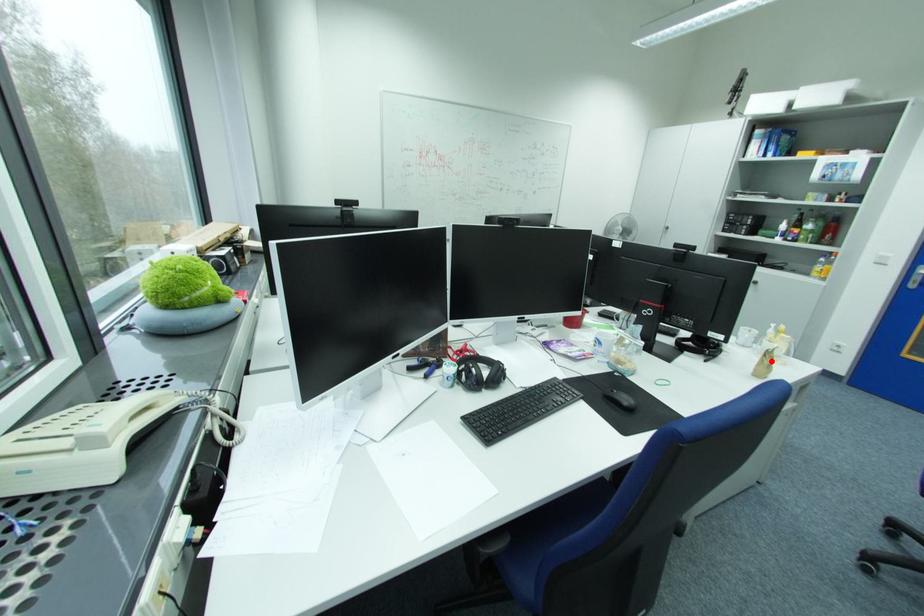
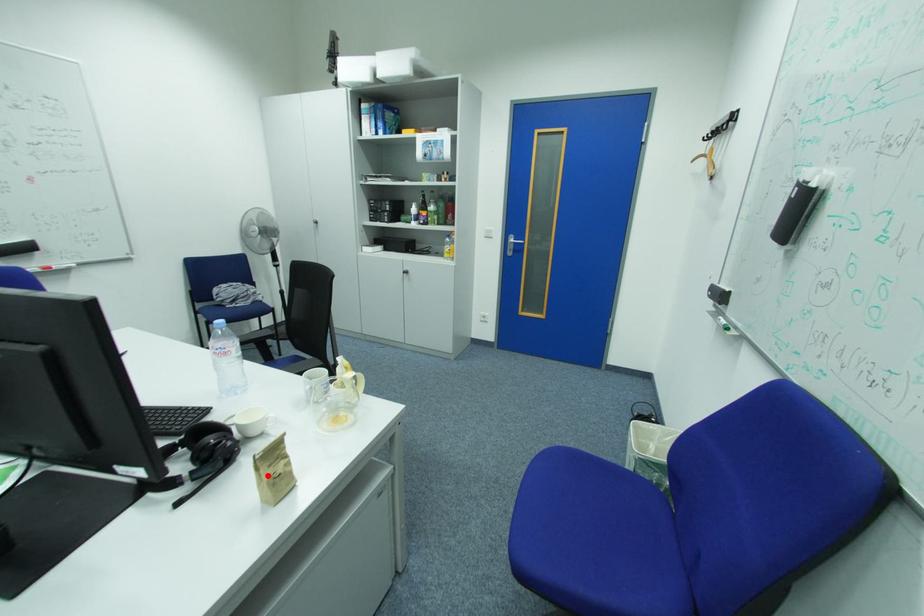
I am providing you with two images of the same scene from different viewpoints. A red point is marked on the first image and another point is marked on the second image. Are the points marked in image1 and image2 representing the same 3D position?

Yes